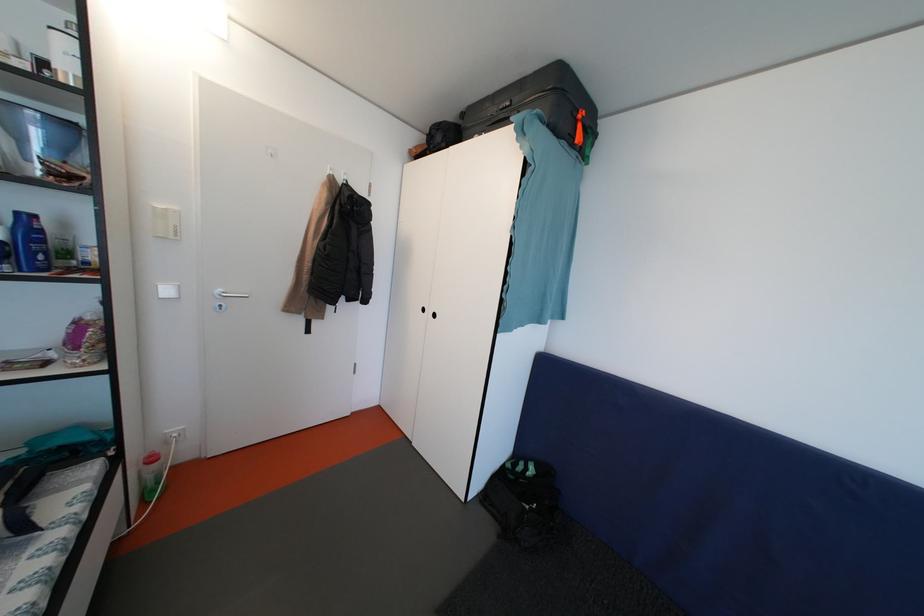
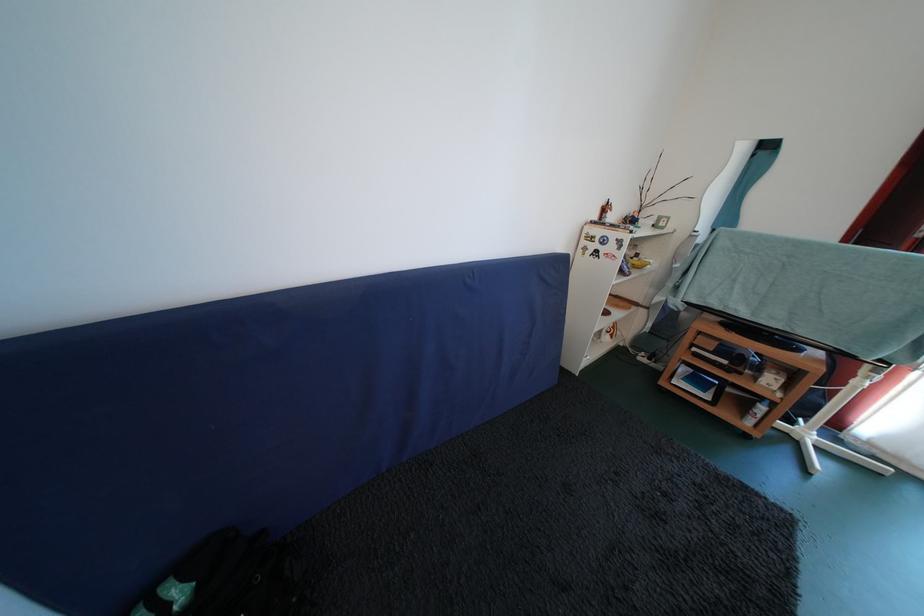
Based on the continuous images, in which direction is the camera rotating?

The camera's rotation is toward right-down.